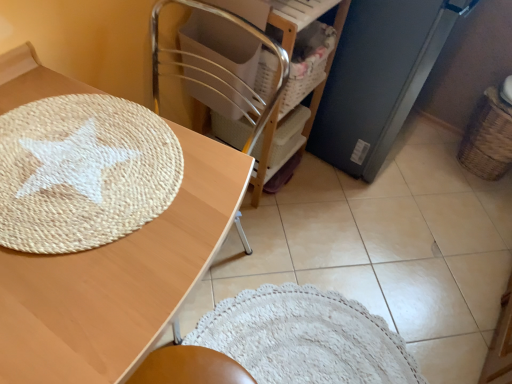
Question: Does matte black refrigerator at right have a smaller size compared to wooden chair at center?

Choices:
 (A) no
 (B) yes

Answer: (A)

Question: Considering the relative sizes of matte black refrigerator at right and wooden chair at center in the image provided, is matte black refrigerator at right bigger than wooden chair at center?

Choices:
 (A) yes
 (B) no

Answer: (A)

Question: Is matte black refrigerator at right to the left of wooden chair at center from the viewer's perspective?

Choices:
 (A) no
 (B) yes

Answer: (A)

Question: Considering the relative sizes of matte black refrigerator at right and wooden chair at center in the image provided, is matte black refrigerator at right thinner than wooden chair at center?

Choices:
 (A) yes
 (B) no

Answer: (B)

Question: Is matte black refrigerator at right wider than wooden chair at center?

Choices:
 (A) no
 (B) yes

Answer: (B)

Question: From the image's perspective, is matte black refrigerator at right under wooden chair at center?

Choices:
 (A) no
 (B) yes

Answer: (A)

Question: From a real-world perspective, is natural wood table at upper left positioned under wooden chair at center based on gravity?

Choices:
 (A) no
 (B) yes

Answer: (A)

Question: From the image's perspective, is natural wood table at upper left located beneath wooden chair at center?

Choices:
 (A) yes
 (B) no

Answer: (A)

Question: Is natural wood table at upper left thinner than wooden chair at center?

Choices:
 (A) no
 (B) yes

Answer: (A)

Question: From a real-world perspective, is natural wood table at upper left positioned over wooden chair at center based on gravity?

Choices:
 (A) yes
 (B) no

Answer: (A)

Question: Does natural wood table at upper left have a greater height compared to wooden chair at center?

Choices:
 (A) no
 (B) yes

Answer: (A)

Question: Can you confirm if natural wood table at upper left is positioned to the left of wooden chair at center?

Choices:
 (A) yes
 (B) no

Answer: (A)

Question: Could you tell me if woven brown basket at right is facing natural wood table at upper left?

Choices:
 (A) yes
 (B) no

Answer: (A)